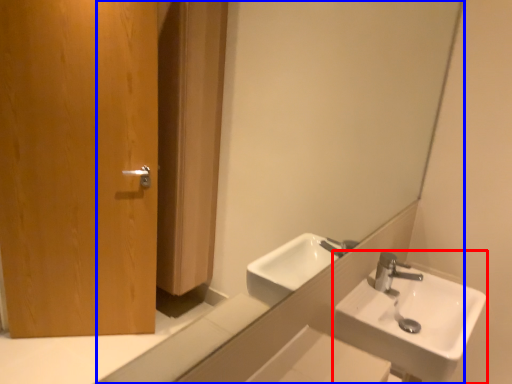
Question: Which object appears closest to the camera in this image, sink (highlighted by a red box) or mirror (highlighted by a blue box)?

Choices:
 (A) sink
 (B) mirror

Answer: (B)